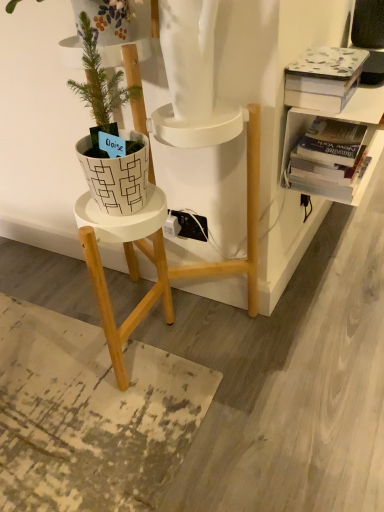
Question: Is white matte pot at left a part of hardcover book at upper right, placed as the first book when sorted from bottom to top?

Choices:
 (A) no
 (B) yes

Answer: (A)

Question: Is hardcover book at upper right, placed as the first book when sorted from bottom to top, in front of white matte pot at left?

Choices:
 (A) yes
 (B) no

Answer: (B)

Question: Is hardcover book at upper right, placed as the first book when sorted from bottom to top, shorter than white matte pot at left?

Choices:
 (A) no
 (B) yes

Answer: (B)

Question: Is hardcover book at upper right, placed as the first book when sorted from bottom to top, located outside white matte pot at left?

Choices:
 (A) no
 (B) yes

Answer: (B)

Question: Does hardcover book at upper right, placed as the first book when sorted from bottom to top, appear on the left side of white matte pot at left?

Choices:
 (A) yes
 (B) no

Answer: (B)

Question: Visually, is hardcover book at upper right, placed as the second book when sorted from top to bottom, positioned to the left or to the right of white textured book at upper right, the first book when ordered from top to bottom?

Choices:
 (A) left
 (B) right

Answer: (B)

Question: Considering the positions of point (345, 174) and point (321, 92), is point (345, 174) closer or farther from the camera than point (321, 92)?

Choices:
 (A) farther
 (B) closer

Answer: (A)

Question: Looking at their shapes, would you say hardcover book at upper right, placed as the first book when sorted from bottom to top, is wider or thinner than white textured book at upper right, the first book when ordered from top to bottom?

Choices:
 (A) wide
 (B) thin

Answer: (A)

Question: In terms of height, does hardcover book at upper right, placed as the second book when sorted from top to bottom, look taller or shorter compared to white textured book at upper right, the 2th book from the bottom?

Choices:
 (A) tall
 (B) short

Answer: (B)

Question: Is white matte pot at left to the left or to the right of white textured book at upper right, the 2th book from the bottom, in the image?

Choices:
 (A) right
 (B) left

Answer: (B)

Question: Is white matte pot at left in front of or behind white textured book at upper right, the 2th book from the bottom, in the image?

Choices:
 (A) front
 (B) behind

Answer: (A)

Question: Looking at the image, does white matte pot at left seem bigger or smaller compared to white textured book at upper right, the 2th book from the bottom?

Choices:
 (A) big
 (B) small

Answer: (A)

Question: From the image's perspective, is white matte pot at left located above or below white textured book at upper right, the first book when ordered from top to bottom?

Choices:
 (A) below
 (B) above

Answer: (A)

Question: In terms of height, does white textured book at upper right, the 2th book from the bottom, look taller or shorter compared to white matte pot at left?

Choices:
 (A) tall
 (B) short

Answer: (B)

Question: Visually, is white textured book at upper right, the first book when ordered from top to bottom, positioned to the left or to the right of white matte pot at left?

Choices:
 (A) left
 (B) right

Answer: (B)